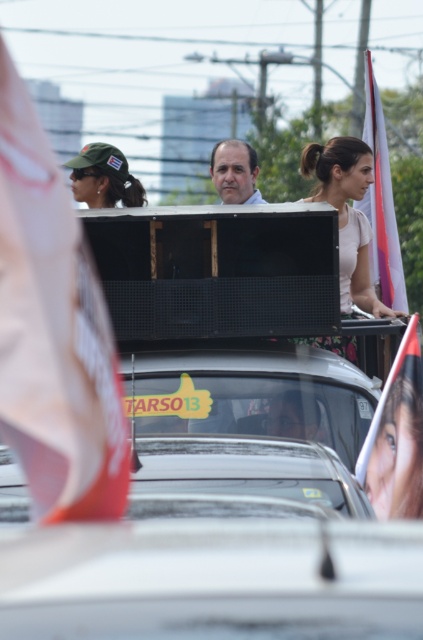
You are a photographer trying to capture the Cuban flag emblem on the green fabric cap at upper left and the green fabric flag at upper left in the same frame. Which object should you zoom in on to ensure both are visible without cropping?

The green fabric flag at upper left has a smaller width than the green fabric cap at upper left, so you should zoom in on the green fabric cap at upper left to include both objects in the frame.

You are a photographer at the event and need to capture a photo where both the green fabric flag at upper left and the green fabric cap at upper left are visible. Based on their positions, which one should you adjust your camera to focus on first to ensure both are in frame?

The green fabric flag at upper left is to the right of the green fabric cap at upper left, so you should focus on the green fabric cap at upper left first to ensure both are in frame.

You are standing at the origin point in the image. Which of the two points, point [71,208] or point [379,449], is closer to you?

Point [71,208] is in front of point [379,449], so it is closer to you.